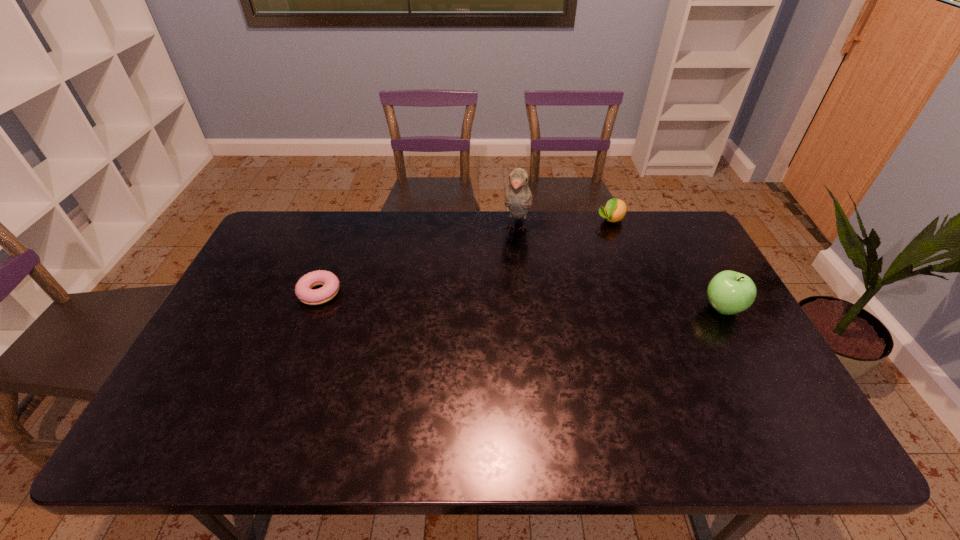
Image resolution: width=960 pixels, height=540 pixels. I want to click on vacant point located between the shortest object and the third shortest object, so click(x=521, y=300).

Image resolution: width=960 pixels, height=540 pixels. Find the location of `vacant area that lies between the leftmost object and the second shortest object`. vacant area that lies between the leftmost object and the second shortest object is located at coordinates (466, 256).

Where is `free spot between the leftmost object and the lemon`? The image size is (960, 540). free spot between the leftmost object and the lemon is located at coordinates (466, 256).

You are a GUI agent. You are given a task and a screenshot of the screen. Output one action in this format:
    pyautogui.click(x=<x>, y=<y>)
    Task: Click on the free space between the leftmost object and the apple
    The image size is (960, 540).
    Given the screenshot: What is the action you would take?
    pyautogui.click(x=521, y=300)

Where is `object that is the second closest to the third shortest object`? object that is the second closest to the third shortest object is located at coordinates (518, 198).

Identify which object is the second closest to the bird. Please provide its 2D coordinates. Your answer should be formatted as a tuple, i.e. [(x, y)], where the tuple contains the x and y coordinates of a point satisfying the conditions above.

[(729, 292)]

At what (x,y) coordinates should I click in order to perform the action: click on free location that satisfies the following two spatial constraints: 1. on the back side of the tallest object; 2. on the right side of the shortest object. Please return your answer as a coordinate pair (x, y). The width and height of the screenshot is (960, 540). Looking at the image, I should click on (344, 229).

Locate an element on the screen. free space that satisfies the following two spatial constraints: 1. on the back side of the leftmost object; 2. on the right side of the tallest object is located at coordinates (344, 229).